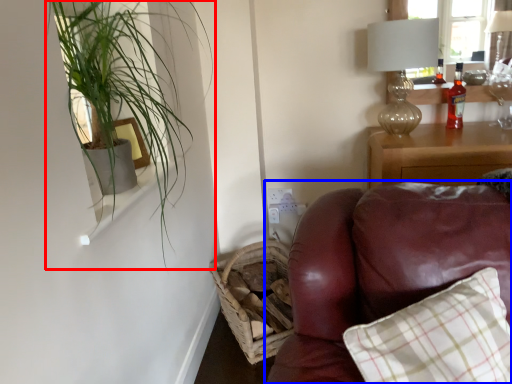
Question: Which object is further to the camera taking this photo, houseplant (highlighted by a red box) or studio couch (highlighted by a blue box)?

Choices:
 (A) houseplant
 (B) studio couch

Answer: (A)